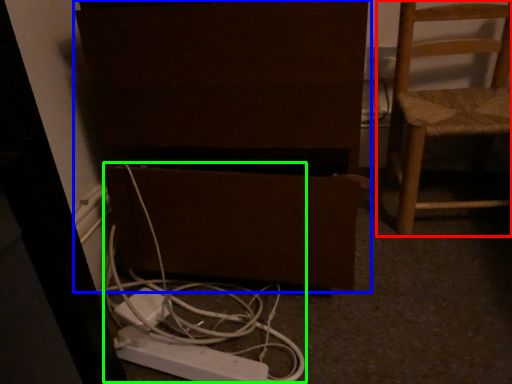
Question: Which is farther away from chair (highlighted by a red box)? furniture (highlighted by a blue box) or cable (highlighted by a green box)?

Choices:
 (A) furniture
 (B) cable

Answer: (B)